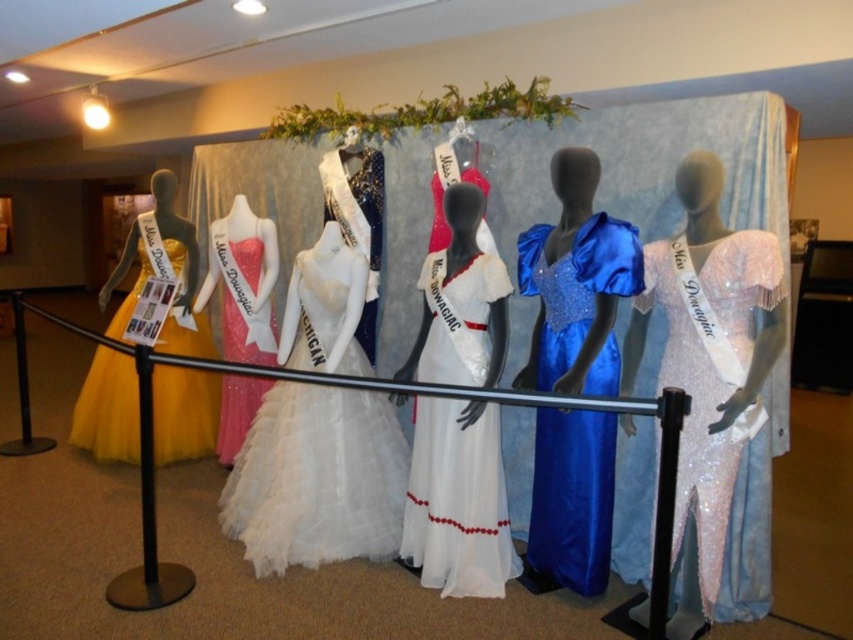
Question: Considering the real-world distances, which object is closest to the matte yellow tulle dress at left?

Choices:
 (A) shiny pink gown at center
 (B) satin white dress at center

Answer: (A)

Question: Which point is farther to the camera?

Choices:
 (A) satin blue gown at center
 (B) matte yellow tulle dress at left

Answer: (B)

Question: Which object is positioned farthest from the satin white dress at center?

Choices:
 (A) shiny sequined dress at center
 (B) matte yellow tulle dress at left
 (C) satin blue gown at center
 (D) white tulle gown at center

Answer: (A)

Question: Considering the relative positions of satin blue gown at center and shiny pink gown at center in the image provided, where is satin blue gown at center located with respect to shiny pink gown at center?

Choices:
 (A) left
 (B) right

Answer: (B)

Question: Can you confirm if satin blue gown at center is positioned to the left of shiny pink gown at center?

Choices:
 (A) yes
 (B) no

Answer: (B)

Question: Is white tulle gown at center further to camera compared to satin blue gown at center?

Choices:
 (A) yes
 (B) no

Answer: (A)